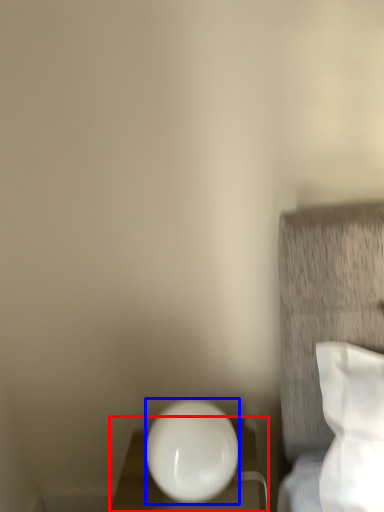
Question: Among these objects, which one is farthest to the camera, furniture (highlighted by a red box) or oval (highlighted by a blue box)?

Choices:
 (A) furniture
 (B) oval

Answer: (A)